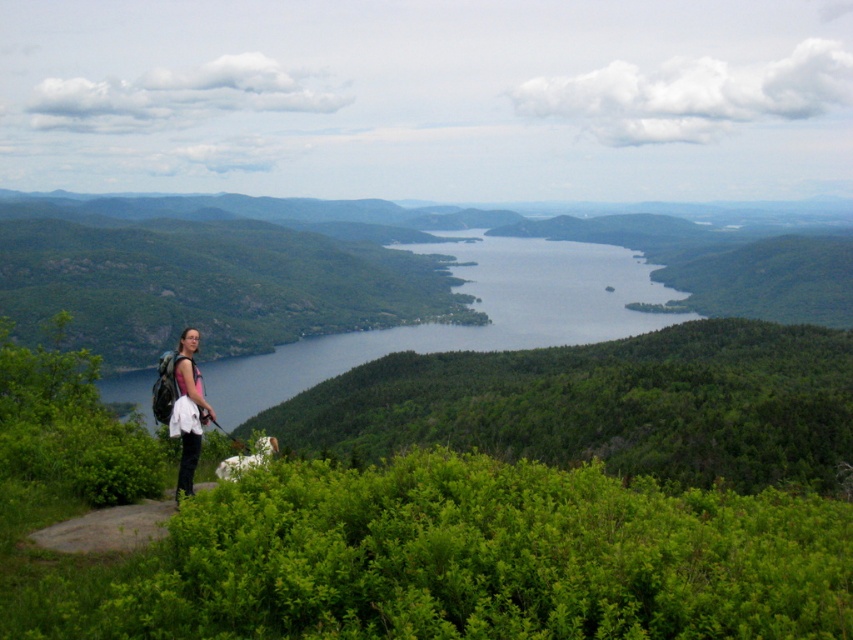
You are a photographer standing at the green grassy hillside at lower left and want to take a photo of the distant landscape. Your camera has a maximum focus range of 50 feet. Can you capture the landscape clearly with your current position?

The distance between the green grassy hillside at lower left and the camera is 45.65 feet, which is within the camera maximum focus range of 50 feet. Therefore, you can capture the landscape clearly from your current position.

You are a photographer planning to capture the landscape with the green grassy hillside at lower left and the matte pink shirt at left in the frame. Which object should you focus on first if you want to ensure both are in focus, considering their sizes?

The green grassy hillside at lower left is bigger than the matte pink shirt at left, so focusing on the larger object first would help ensure both are in focus.